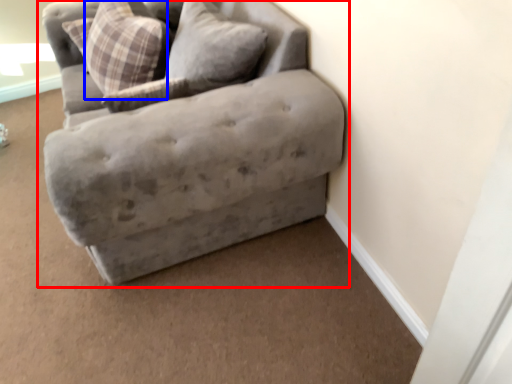
Question: Among these objects, which one is nearest to the camera, studio couch (highlighted by a red box) or pillow (highlighted by a blue box)?

Choices:
 (A) studio couch
 (B) pillow

Answer: (A)